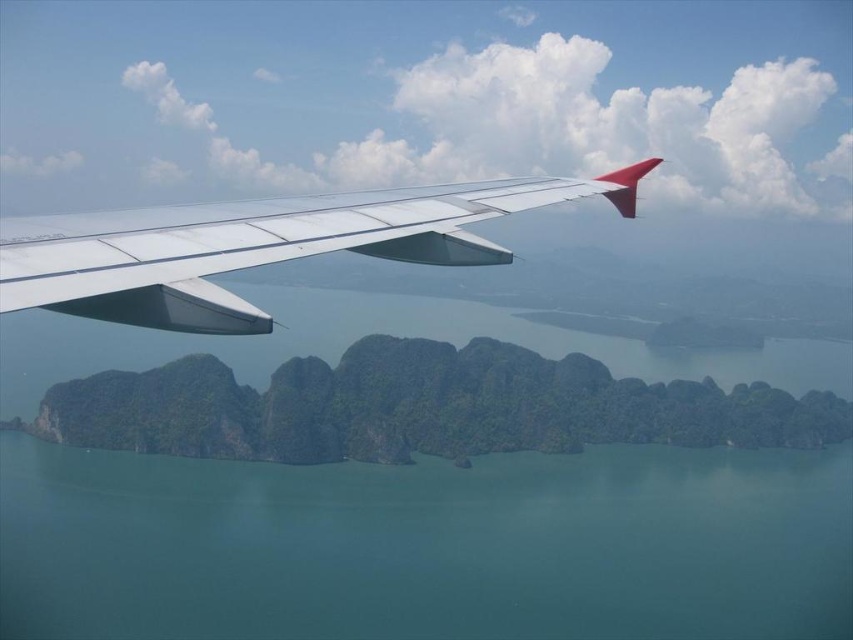
You are a pilot in an airplane. You notice a point marked at coordinates (426, 545) on your map. According to the scene, what is located at that point?

The point at coordinates (426, 545) marks green smooth water at center.

You are a pilot checking the aircraft wing and the water below. Which object, the green smooth water at center or the metallic silver wing at upper left, is wider in the image?

The green smooth water at center might be wider than metallic silver wing at upper left according to the description.